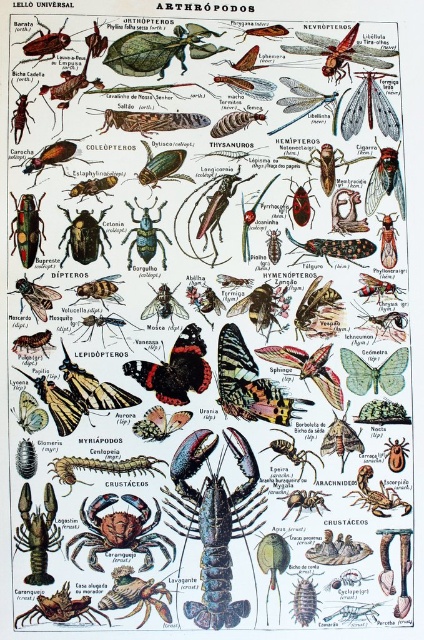
Question: Can you confirm if shiny blue lobster at center is positioned below shiny metallic beetle at center?

Choices:
 (A) yes
 (B) no

Answer: (A)

Question: From the image, what is the correct spatial relationship of shiny metallic beetle at center-left in relation to matte black beetle at center?

Choices:
 (A) below
 (B) above

Answer: (A)

Question: Which point appears closest to the camera in this image?

Choices:
 (A) (217, 484)
 (B) (111, 118)
 (C) (387, 499)

Answer: (A)

Question: Which of these objects is positioned farthest from the shiny blue lobster at lower left?

Choices:
 (A) matte green beetle at center-left
 (B) shiny brown scorpion at lower right
 (C) matte brown beetle at upper center

Answer: (C)

Question: Which of these objects is positioned closest to the matte green beetle at center?

Choices:
 (A) matte green beetle at center-left
 (B) shiny metallic beetle at center-left
 (C) matte black beetle at center

Answer: (A)

Question: Does shiny brown scorpion at lower right have a greater width compared to matte black beetle at center?

Choices:
 (A) yes
 (B) no

Answer: (A)